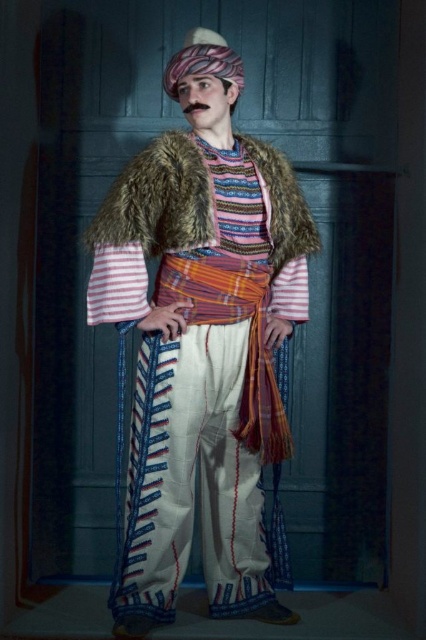
You are a fashion designer observing the image. You need to determine the layering order of the striped woolen shirt at center and the fuzzy brown fur coat at center. Which one is visible on top?

The striped woolen shirt at center is below the fuzzy brown fur coat at center, so the fuzzy brown fur coat at center is visible on top.

You are standing in front of the person in the image. You notice two points marked on their outfit. One is at coordinate point [137,429] and the other at point [155,253]. Which point is closer to you?

Point [137,429] is in front of point [155,253], so it is closer to you.

Based on the scene description, where is the striped woolen shirt at center located in terms of its 2D coordinates?

The striped woolen shirt at center is located at the 2D coordinates of point (201, 340).